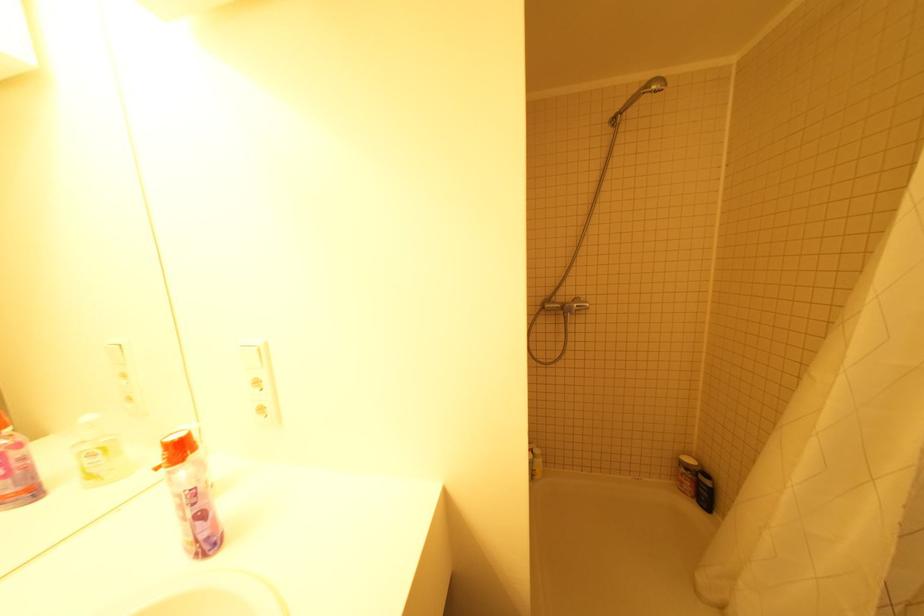
The width and height of the screenshot is (924, 616). What do you see at coordinates (567, 305) in the screenshot?
I see `the faucet handle` at bounding box center [567, 305].